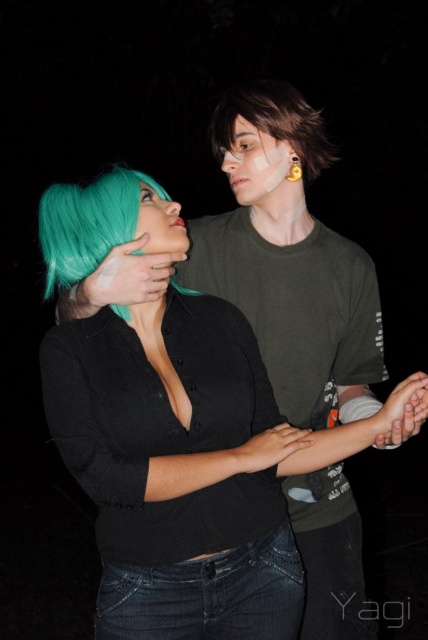
Question: Estimate the real-world distances between objects in this image. Which object is farther from the matte black face at upper center?

Choices:
 (A) teal matte wig at center
 (B) brown matte hair at upper center
 (C) matte black shirt at center

Answer: (C)

Question: Can you confirm if brown matte hair at upper center is thinner than matte black face at upper center?

Choices:
 (A) yes
 (B) no

Answer: (B)

Question: Is the position of matte black shirt at center more distant than that of teal matte wig at center?

Choices:
 (A) yes
 (B) no

Answer: (B)

Question: Which of these objects is positioned closest to the matte black shirt at center?

Choices:
 (A) teal matte wig at center
 (B) matte black face at upper center
 (C) brown matte hair at upper center

Answer: (A)

Question: Which point is farther from the camera taking this photo?

Choices:
 (A) click(284, 93)
 (B) click(158, 474)

Answer: (A)

Question: In this image, where is matte black shirt at center located relative to brown matte hair at upper center?

Choices:
 (A) left
 (B) right

Answer: (A)